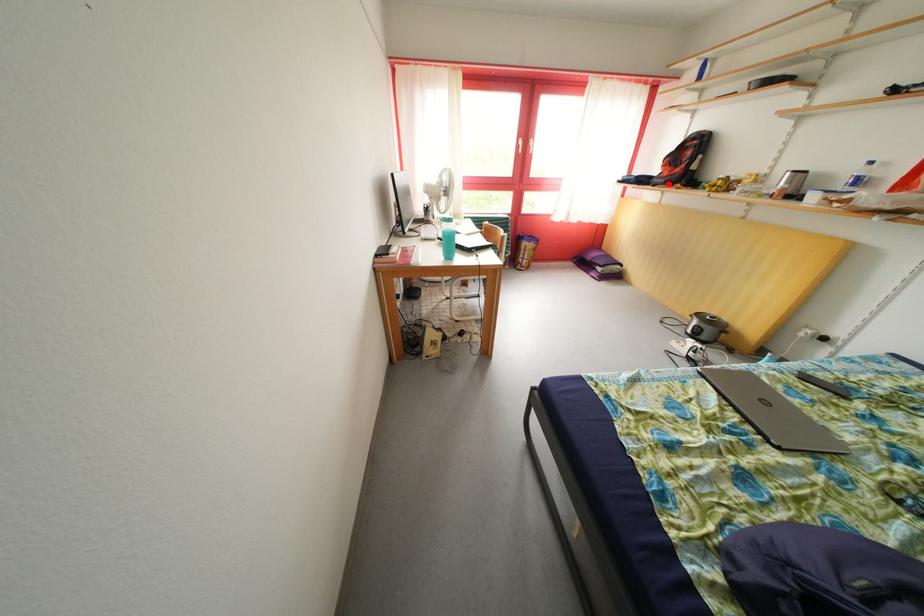
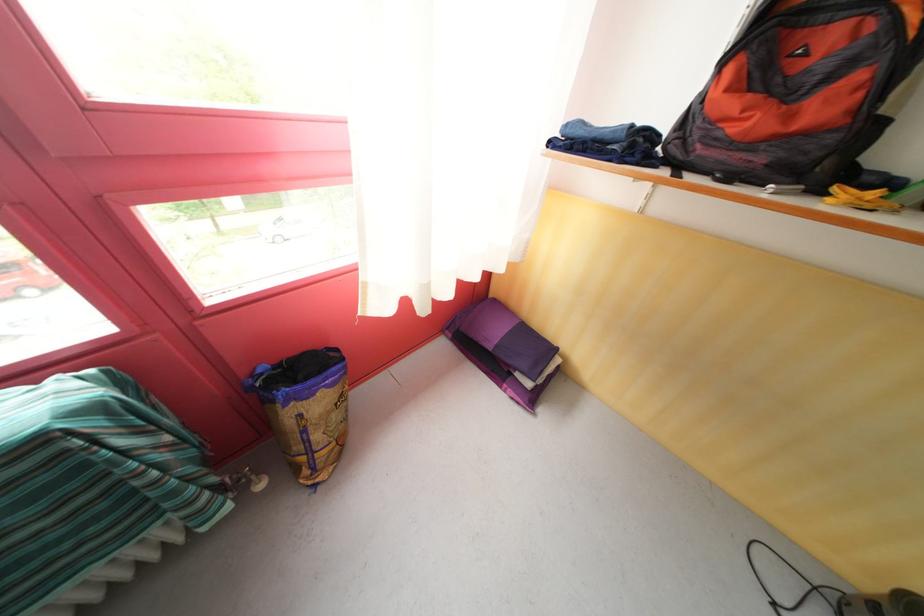
The point at the highlighted location is marked in the first image. Where is the corresponding point in the second image?

(736, 151)